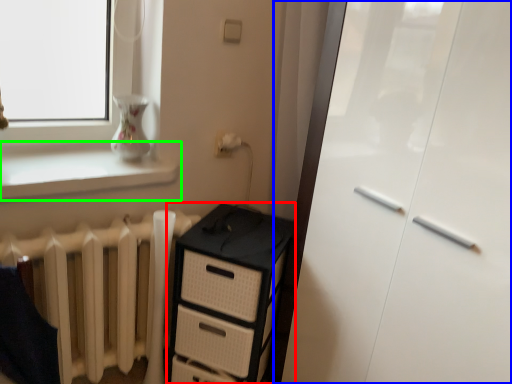
Question: Which object is positioned farthest from chest of drawers (highlighted by a red box)? Select from screen door (highlighted by a blue box) and window sill (highlighted by a green box).

Choices:
 (A) screen door
 (B) window sill

Answer: (B)